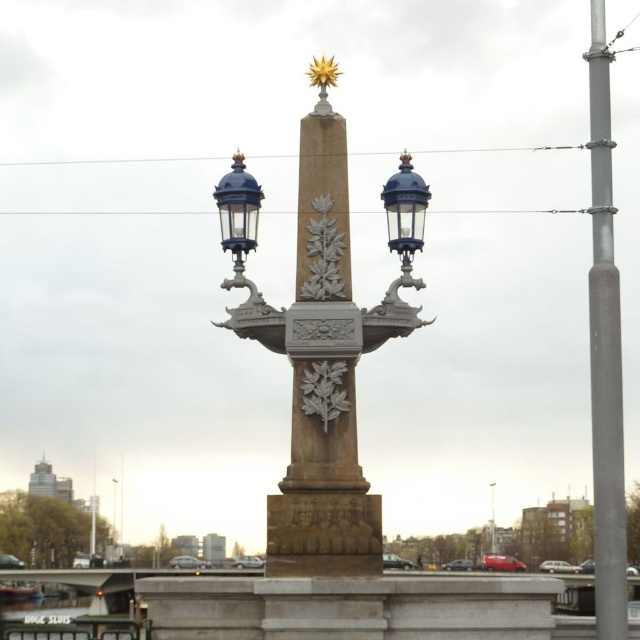
Question: Does stone obelisk at center have a lesser width compared to blue glass lantern at right?

Choices:
 (A) yes
 (B) no

Answer: (B)

Question: Which of these objects is positioned farthest from the stone obelisk at center?

Choices:
 (A) matte blue streetlight at center
 (B) matte gray street light at center
 (C) blue glass lantern at right

Answer: (B)

Question: Which object is the closest to the stone obelisk at center?

Choices:
 (A) matte gray street light at center
 (B) matte blue streetlight at center

Answer: (B)

Question: Based on their relative distances, which object is farther from the matte gray street light at center?

Choices:
 (A) blue glass lantern at right
 (B) stone obelisk at center
 (C) silver metallic pole at right

Answer: (B)

Question: Where is stone obelisk at center located in relation to silver metallic pole at right in the image?

Choices:
 (A) left
 (B) right

Answer: (A)

Question: Is silver metallic pole at right bigger than matte blue streetlight at center?

Choices:
 (A) yes
 (B) no

Answer: (A)